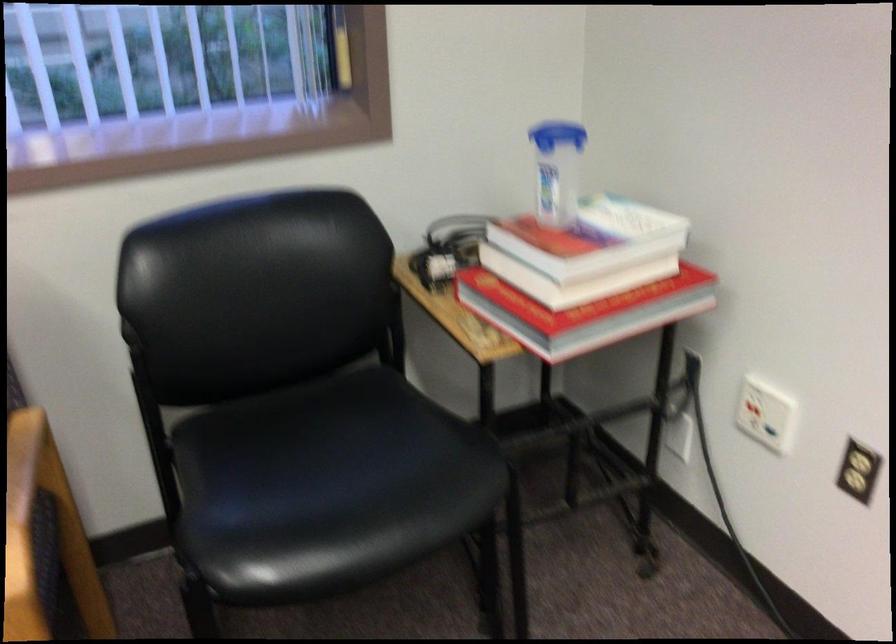
The image size is (896, 644). Identify the location of chair armrest. (151, 421).